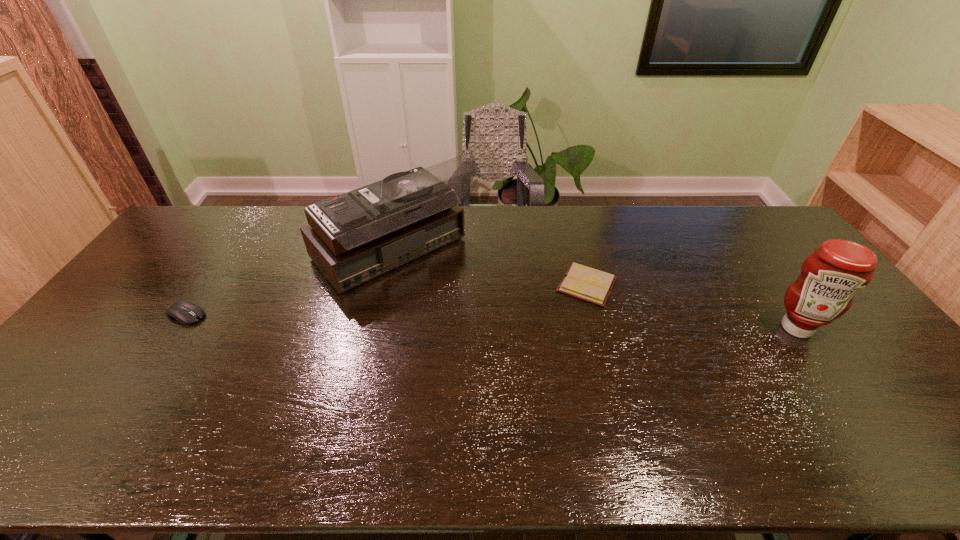
Find the location of a particular element. free space located 0.220m on the front of the leftmost object is located at coordinates (133, 394).

I want to click on vacant space located on the front of the diary, so click(619, 407).

This screenshot has width=960, height=540. Identify the location of object that is at the far edge. (354, 237).

The width and height of the screenshot is (960, 540). I want to click on object located in the right edge section of the desktop, so [830, 277].

At what (x,y) coordinates should I click in order to perform the action: click on free spot at the far edge of the desktop. Please return your answer as a coordinate pair (x, y). The image size is (960, 540). Looking at the image, I should click on (492, 210).

In the image, there is a desktop. Where is `vacant area at the near edge`? vacant area at the near edge is located at coordinates (633, 447).

Image resolution: width=960 pixels, height=540 pixels. I want to click on free space at the left edge of the desktop, so click(115, 309).

In the image, there is a desktop. Where is `vacant space at the right edge`? The image size is (960, 540). vacant space at the right edge is located at coordinates (842, 330).

In the image, there is a desktop. Identify the location of vacant space at the far left corner. (210, 219).

At what (x,y) coordinates should I click in order to perform the action: click on free spot at the far right corner of the desktop. Please return your answer as a coordinate pair (x, y). The image size is (960, 540). Looking at the image, I should click on (754, 219).